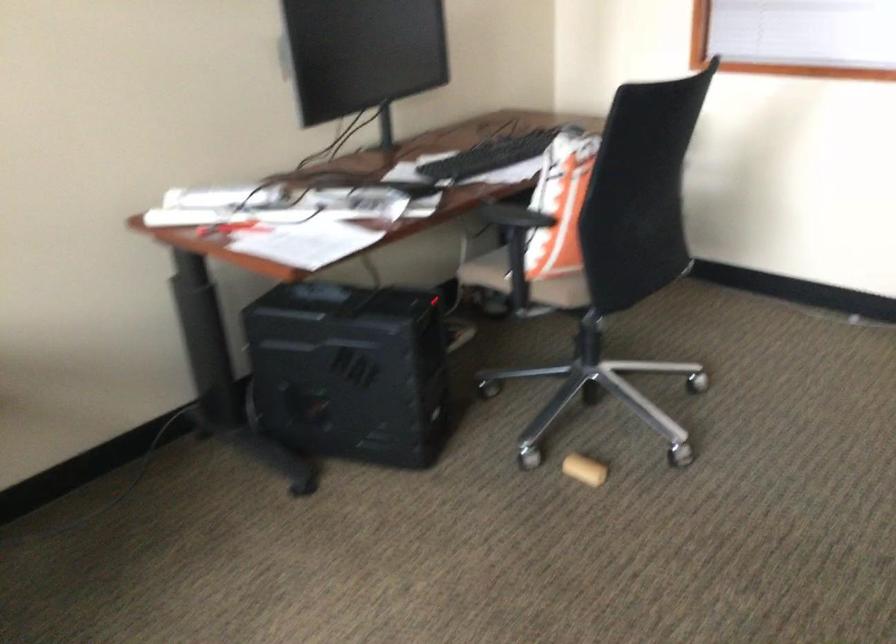
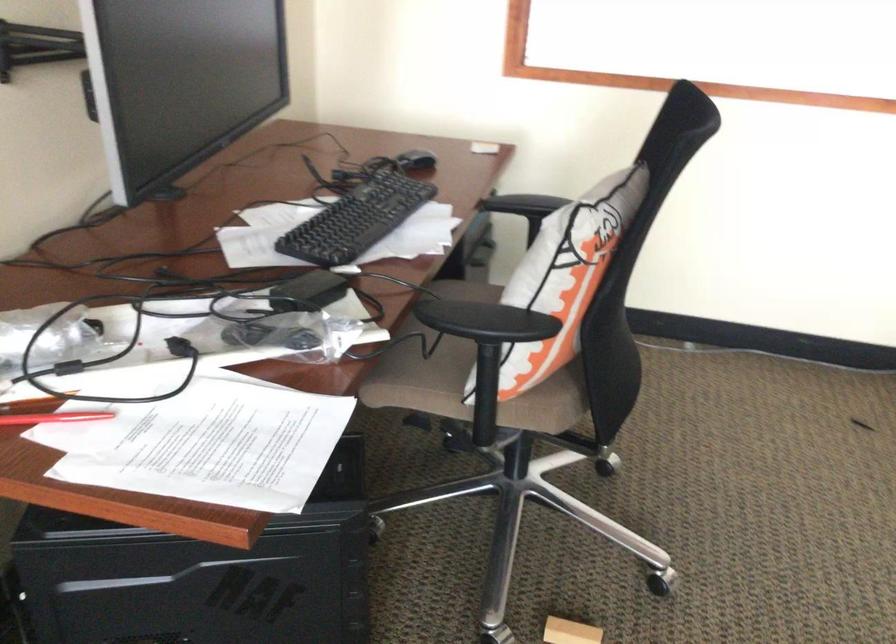
The images are taken continuously from a first-person perspective. In which direction are you moving?

The cameraman walked toward left, forward.